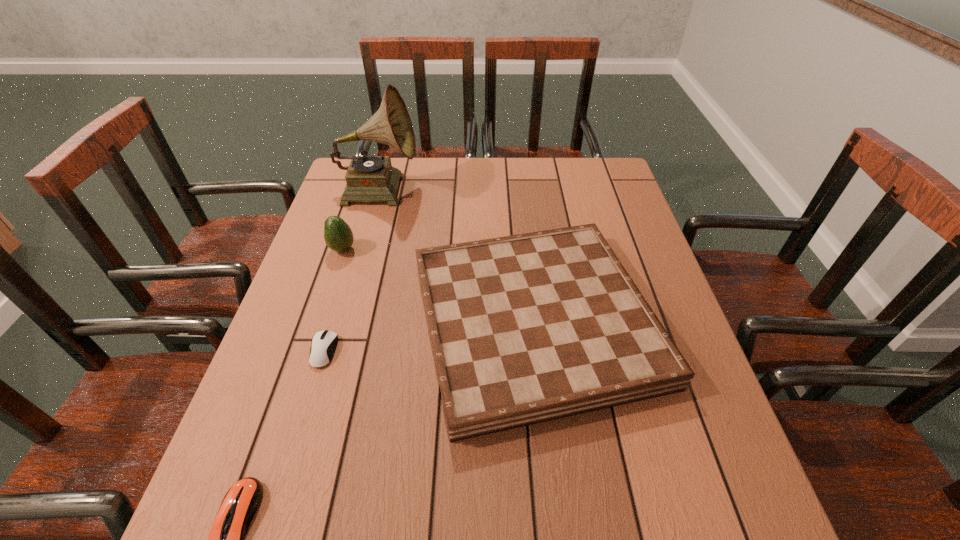
This screenshot has height=540, width=960. Find the location of `vacant space that satisfies the following two spatial constraints: 1. on the back side of the rightmost object; 2. from the horn of the record player`. vacant space that satisfies the following two spatial constraints: 1. on the back side of the rightmost object; 2. from the horn of the record player is located at coordinates (519, 188).

Locate an element on the screen. The width and height of the screenshot is (960, 540). vacant space that satisfies the following two spatial constraints: 1. from the horn of the tallest object; 2. on the left side of the gameboard is located at coordinates pyautogui.click(x=342, y=321).

Locate an element on the screen. vacant space that satisfies the following two spatial constraints: 1. on the front side of the fourth shortest object; 2. on the right side of the farther computer mouse is located at coordinates (309, 351).